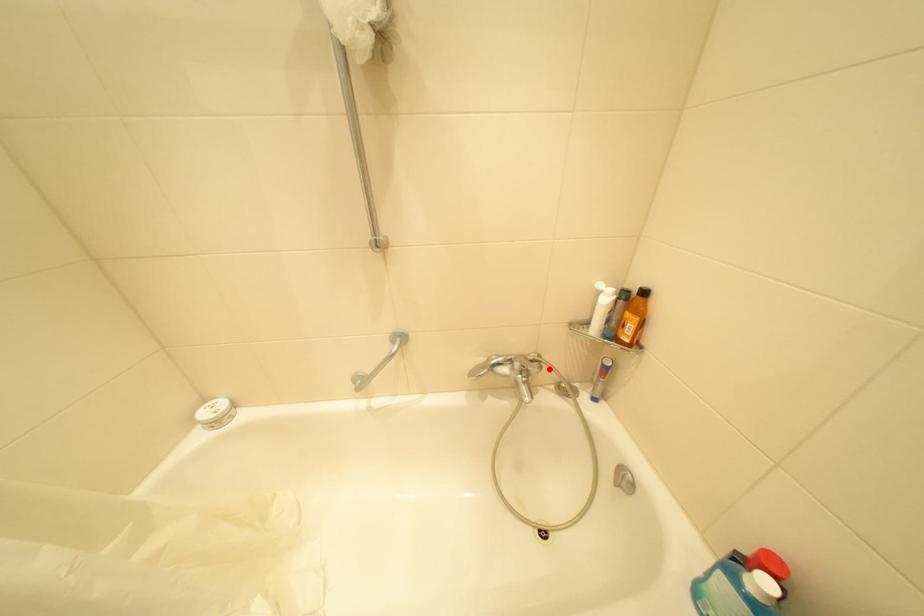
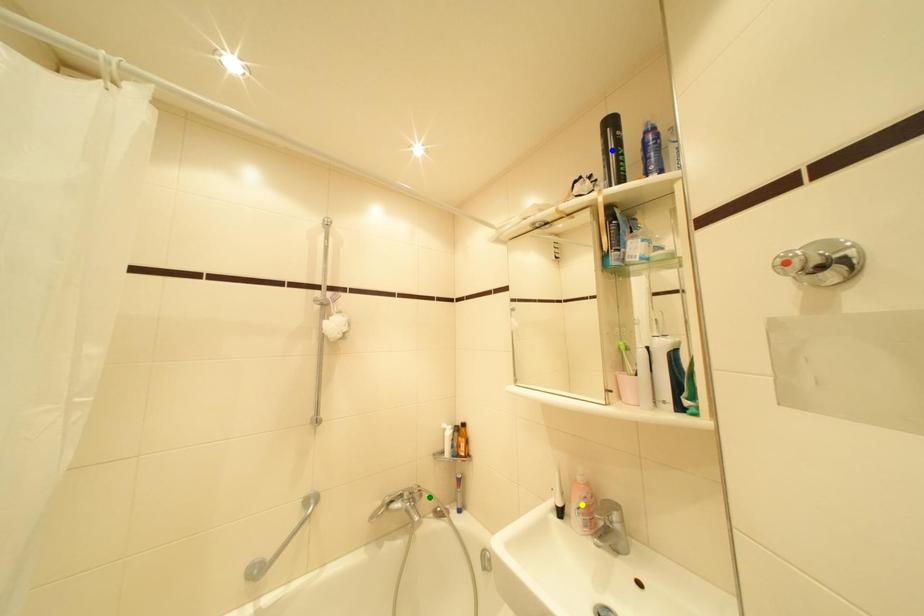
Question: I am providing you with two images of the same scene from different viewpoints. A red point is marked on the first image. You are given multiple points on the second image. Which mark in image 2 goes with the point in image 1?

Choices:
 (A) yellow point
 (B) green point
 (C) blue point

Answer: (B)